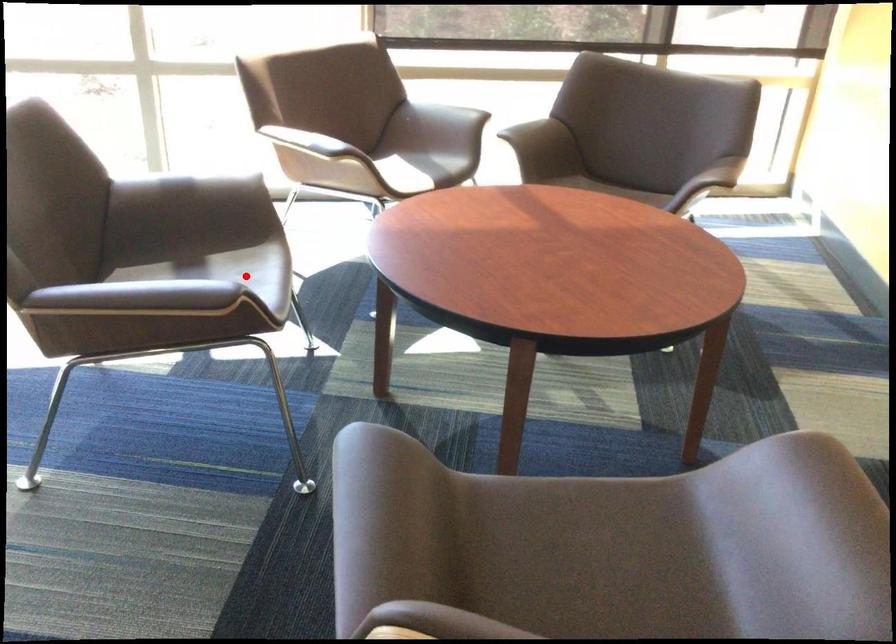
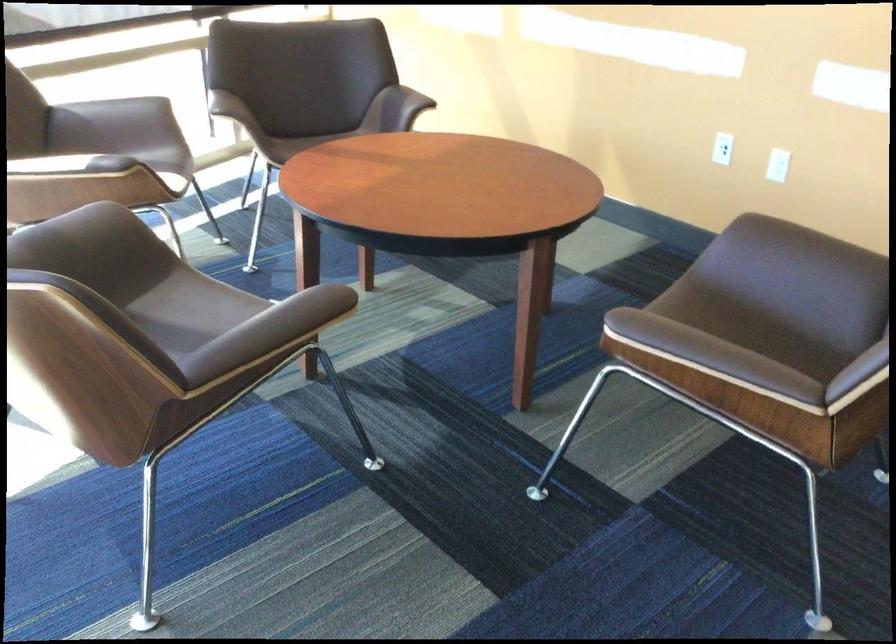
Question: I am providing you with two images of the same scene from different viewpoints. Given a red point in image1, look at the same physical point in image2. Is it:

Choices:
 (A) Closer to the viewpoint
 (B) Farther from the viewpoint

Answer: (A)